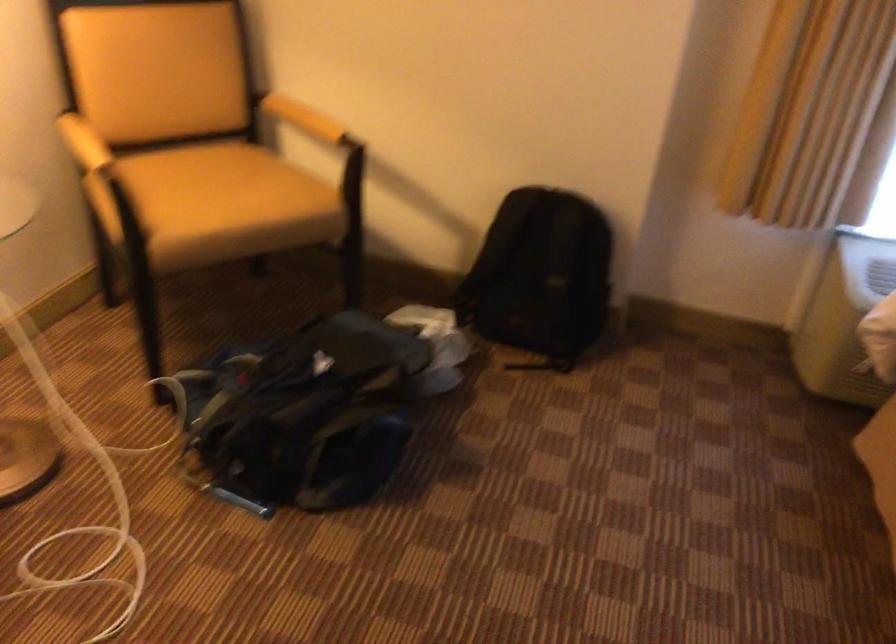
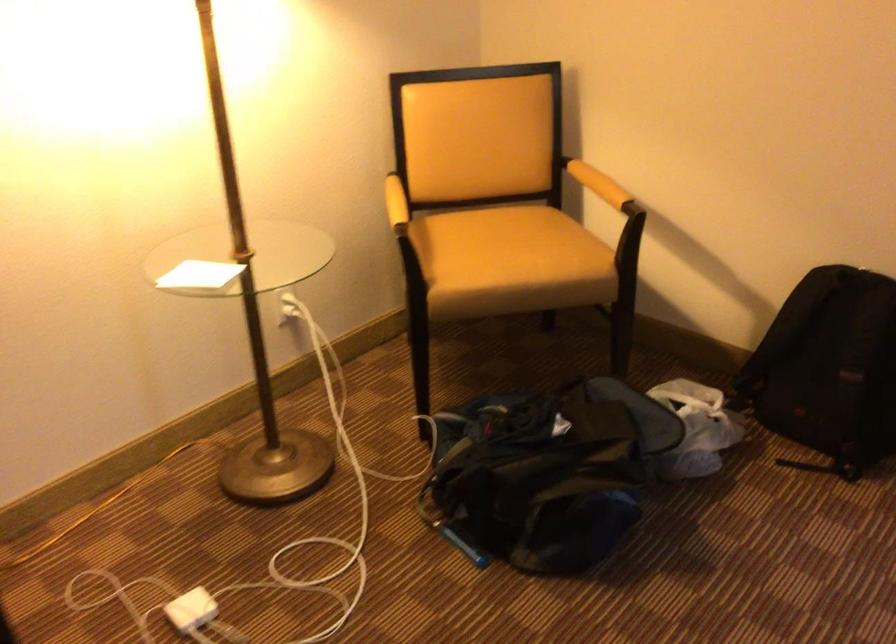
In the second image, find the point that corresponds to point 311,420 in the first image.

(537, 480)